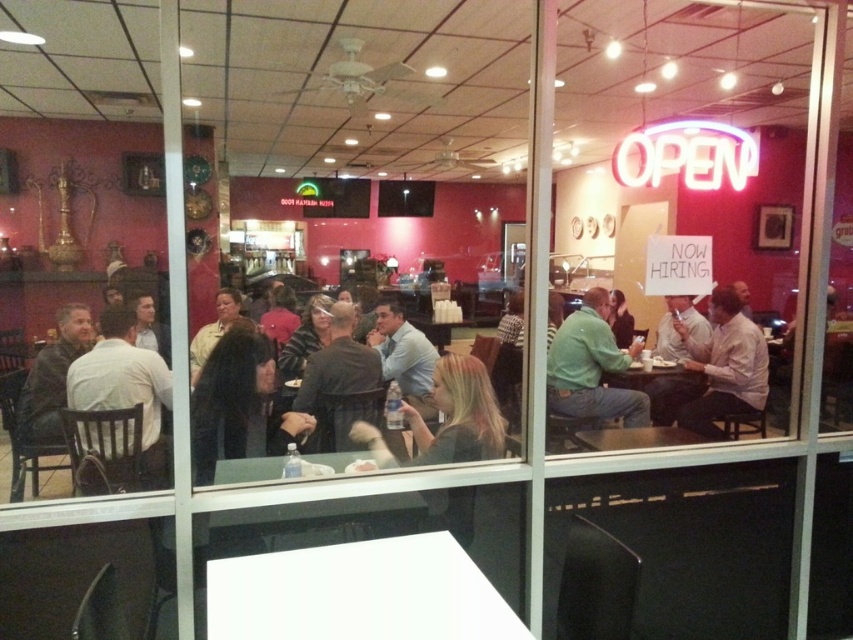
Question: Which of the following is the farthest from the observer?

Choices:
 (A) (218, 592)
 (B) (740, 358)
 (C) (138, 365)

Answer: (B)

Question: Can you confirm if matte blue shirt at center is smaller than matte yellow shirt at center?

Choices:
 (A) yes
 (B) no

Answer: (A)

Question: From the image, what is the correct spatial relationship of leather jacket at left in relation to smooth wooden table at center?

Choices:
 (A) below
 (B) above

Answer: (B)

Question: Estimate the real-world distances between objects in this image. Which object is farther from the neon sign at right?

Choices:
 (A) white shirt at right
 (B) green matte shirt at center
 (C) matte blue shirt at center
 (D) light brown leather jacket at left

Answer: (D)

Question: Is leather jacket at left positioned in front of matte blue shirt at center?

Choices:
 (A) no
 (B) yes

Answer: (A)

Question: Which of the following is the farthest from the observer?

Choices:
 (A) (302, 417)
 (B) (590, 352)
 (C) (721, 442)
 (D) (279, 589)

Answer: (B)